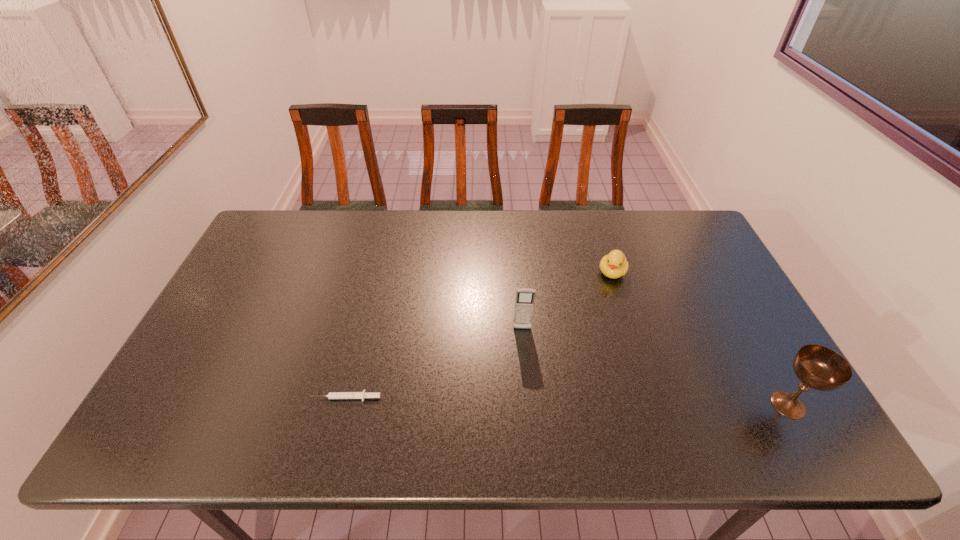
Identify the location of syringe. This screenshot has width=960, height=540. (332, 395).

In order to click on the shortest object in this screenshot , I will do `click(332, 395)`.

Locate an element on the screen. Image resolution: width=960 pixels, height=540 pixels. the rightmost object is located at coordinates (818, 367).

I want to click on the second shortest object, so click(x=614, y=265).

Locate an element on the screen. The width and height of the screenshot is (960, 540). the third object from left to right is located at coordinates (614, 265).

Where is `the third object from right to left`? the third object from right to left is located at coordinates (524, 302).

Find the location of a particular element. the third nearest object is located at coordinates (524, 302).

Where is `free space located 0.060m on the left of the leftmost object`? free space located 0.060m on the left of the leftmost object is located at coordinates (286, 397).

This screenshot has height=540, width=960. Identify the location of vacant space located on the left of the chalice. (628, 405).

Locate an element on the screen. The width and height of the screenshot is (960, 540). vacant space situated on the beak of the third object from left to right is located at coordinates (581, 362).